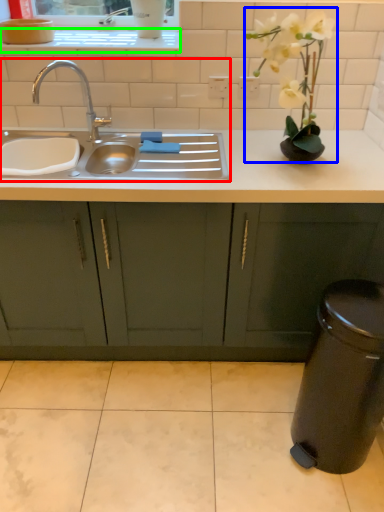
Question: Which is farther away from sink (highlighted by a red box)? floral arrangement (highlighted by a blue box) or window sill (highlighted by a green box)?

Choices:
 (A) floral arrangement
 (B) window sill

Answer: (A)